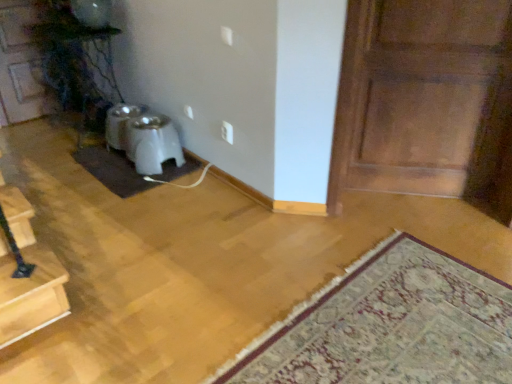
Question: Is wooden door at upper left, which is the second door from front to back, not near white plastic electric outlet at center?

Choices:
 (A) no
 (B) yes

Answer: (B)

Question: From the image's perspective, does wooden door at upper left, the 1th door from the left, appear higher than white plastic electric outlet at center?

Choices:
 (A) yes
 (B) no

Answer: (A)

Question: Is wooden door at upper left, which is the 2th door from right to left, next to white plastic electric outlet at center?

Choices:
 (A) yes
 (B) no

Answer: (B)

Question: Considering the relative sizes of wooden door at upper left, which is the 2th door from right to left, and white plastic electric outlet at center in the image provided, is wooden door at upper left, which is the 2th door from right to left, wider than white plastic electric outlet at center?

Choices:
 (A) no
 (B) yes

Answer: (B)

Question: Considering the relative sizes of wooden door at upper left, which is the second door from front to back, and white plastic electric outlet at center in the image provided, is wooden door at upper left, which is the second door from front to back, smaller than white plastic electric outlet at center?

Choices:
 (A) no
 (B) yes

Answer: (A)

Question: Is wooden door at upper left, which is the second door from front to back, thinner than white plastic electric outlet at center?

Choices:
 (A) no
 (B) yes

Answer: (A)

Question: Does wooden door at upper left, which is the 2th door from right to left, turn towards carpeted rug at lower right?

Choices:
 (A) yes
 (B) no

Answer: (A)

Question: Is wooden door at upper left, the 1th door from the left, smaller than carpeted rug at lower right?

Choices:
 (A) no
 (B) yes

Answer: (B)

Question: Can you confirm if wooden door at upper left, arranged as the first door when viewed from the back, is positioned to the left of carpeted rug at lower right?

Choices:
 (A) no
 (B) yes

Answer: (B)

Question: From the image's perspective, is wooden door at upper left, which is the 2th door from right to left, under carpeted rug at lower right?

Choices:
 (A) no
 (B) yes

Answer: (A)

Question: Considering the relative sizes of wooden door at upper left, which is the second door from front to back, and carpeted rug at lower right in the image provided, is wooden door at upper left, which is the second door from front to back, wider than carpeted rug at lower right?

Choices:
 (A) yes
 (B) no

Answer: (B)

Question: Is wooden door at upper left, which is the second door from front to back, further to camera compared to carpeted rug at lower right?

Choices:
 (A) no
 (B) yes

Answer: (B)

Question: From the image's perspective, does white plastic electric outlet at center appear lower than white plastic pet feeder at center?

Choices:
 (A) no
 (B) yes

Answer: (A)